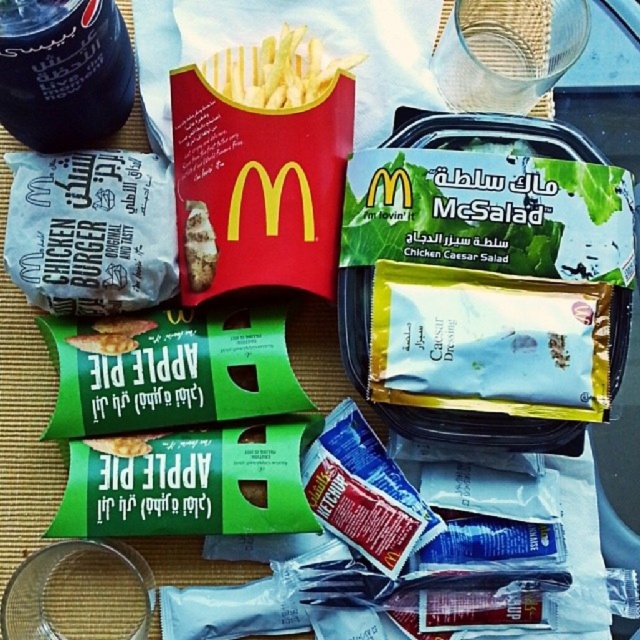
You are looking at the McDonalds meal on the bamboo placemat. There are two points marked in the image. Which point, point [10,122] or point [282,51], is closer to you?

Point [10,122] is closer to the viewer than point [282,51].

You are a customer at McDonalds who wants to grab your drink first. You see the white paper chicken burger at left and the dark matte soda can at upper left. Which one is easier to reach without moving the other items?

The dark matte soda can at upper left is behind the white paper chicken burger at left, so you would need to move the burger to reach the soda can. Therefore, the white paper chicken burger at left is easier to reach first without moving other items.